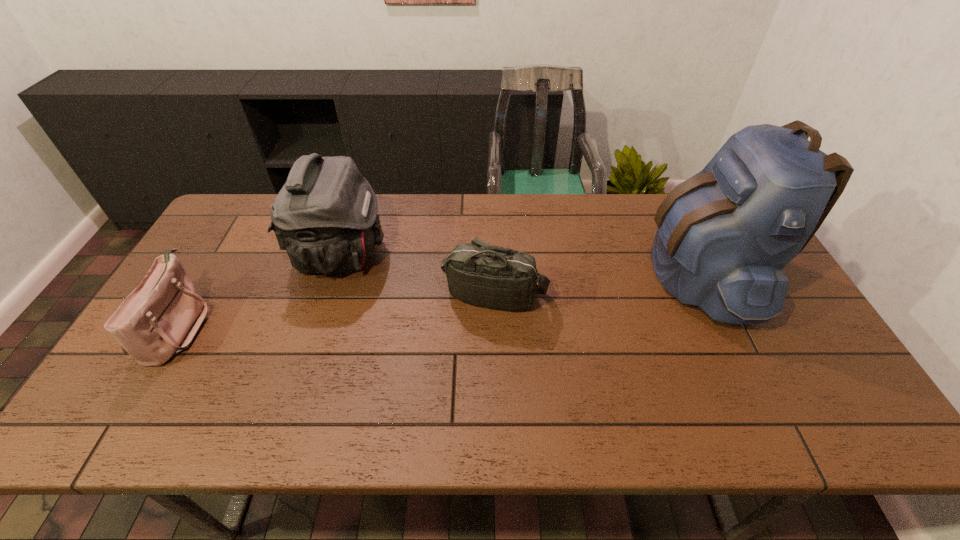
Where is `the tallest object`? The height and width of the screenshot is (540, 960). the tallest object is located at coordinates (724, 236).

I want to click on backpack, so click(x=724, y=236).

Locate an element on the screen. the tallest shoulder bag is located at coordinates (325, 216).

The image size is (960, 540). In order to click on the second tallest object in this screenshot , I will do `click(325, 216)`.

The image size is (960, 540). I want to click on the second shortest shoulder bag, so click(478, 273).

Where is `the third tallest object`? the third tallest object is located at coordinates (478, 273).

Locate an element on the screen. The image size is (960, 540). the shortest object is located at coordinates (158, 319).

The width and height of the screenshot is (960, 540). Find the location of `the leftmost object`. the leftmost object is located at coordinates (158, 319).

Where is `vacant space located at the front pocket of the backpack`? vacant space located at the front pocket of the backpack is located at coordinates click(x=512, y=273).

The height and width of the screenshot is (540, 960). Identify the location of vacant position located at the front pocket of the backpack. (546, 273).